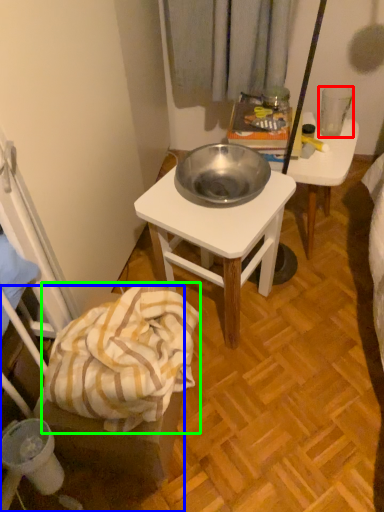
Question: Which object is the closest to the coffee cup (highlighted by a red box)? Choose among these: chair (highlighted by a blue box) or blanket (highlighted by a green box).

Choices:
 (A) chair
 (B) blanket

Answer: (B)